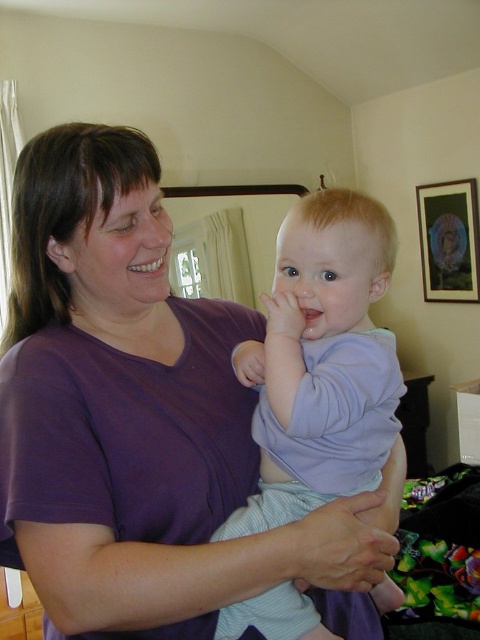
What are the coordinates of the light blue cotton baby at center?

The light blue cotton baby at center is located at point (322, 362).